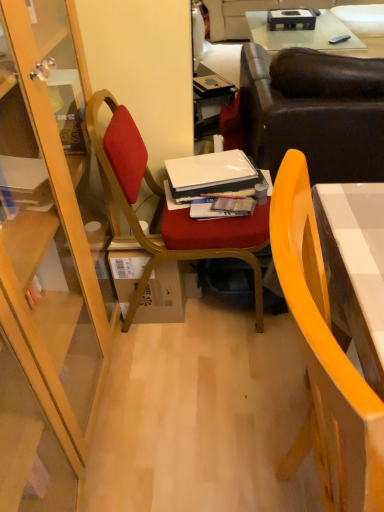
Question: From a real-world perspective, is leather couch at upper right positioned over leather couch at upper center based on gravity?

Choices:
 (A) yes
 (B) no

Answer: (A)

Question: Is leather couch at upper right positioned in front of leather couch at upper center?

Choices:
 (A) no
 (B) yes

Answer: (B)

Question: Considering the relative sizes of leather couch at upper right and leather couch at upper center in the image provided, is leather couch at upper right smaller than leather couch at upper center?

Choices:
 (A) yes
 (B) no

Answer: (A)

Question: From the image's perspective, does leather couch at upper right appear higher than leather couch at upper center?

Choices:
 (A) no
 (B) yes

Answer: (A)

Question: Does leather couch at upper right contain leather couch at upper center?

Choices:
 (A) yes
 (B) no

Answer: (B)

Question: Based on their positions, is matte paper magazine at center located to the left or right of brown cardboard box at center?

Choices:
 (A) right
 (B) left

Answer: (A)

Question: Considering the positions of matte paper magazine at center and brown cardboard box at center in the image, is matte paper magazine at center taller or shorter than brown cardboard box at center?

Choices:
 (A) short
 (B) tall

Answer: (A)

Question: Is matte paper magazine at center bigger or smaller than brown cardboard box at center?

Choices:
 (A) small
 (B) big

Answer: (A)

Question: Is matte paper magazine at center wider or thinner than brown cardboard box at center?

Choices:
 (A) wide
 (B) thin

Answer: (B)

Question: Looking at their shapes, would you say matte wood chair at center, the 1th chair viewed from the back, is wider or thinner than matte paper magazine at center?

Choices:
 (A) thin
 (B) wide

Answer: (B)

Question: Do you think matte wood chair at center, which appears as the 2th chair when viewed from the front, is within matte paper magazine at center, or outside of it?

Choices:
 (A) inside
 (B) outside

Answer: (B)

Question: Considering the positions of matte wood chair at center, which appears as the 2th chair when viewed from the front, and matte paper magazine at center in the image, is matte wood chair at center, which appears as the 2th chair when viewed from the front, bigger or smaller than matte paper magazine at center?

Choices:
 (A) big
 (B) small

Answer: (A)

Question: From the image's perspective, is matte wood chair at center, which appears as the 2th chair when viewed from the front, positioned above or below matte paper magazine at center?

Choices:
 (A) above
 (B) below

Answer: (B)

Question: Looking at their shapes, would you say brown cardboard box at center is wider or thinner than matte wood chair at center, which appears as the 2th chair when viewed from the front?

Choices:
 (A) wide
 (B) thin

Answer: (B)

Question: Considering the positions of brown cardboard box at center and matte wood chair at center, the 1th chair viewed from the back, in the image, is brown cardboard box at center taller or shorter than matte wood chair at center, the 1th chair viewed from the back,?

Choices:
 (A) short
 (B) tall

Answer: (A)